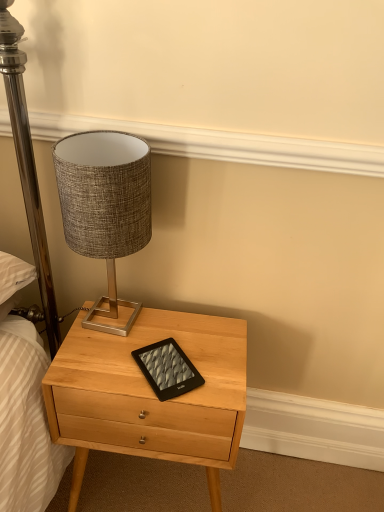
Question: Does light wood nightstand at center have a greater width compared to black matte tablet at center?

Choices:
 (A) no
 (B) yes

Answer: (B)

Question: Can you confirm if light wood nightstand at center is smaller than black matte tablet at center?

Choices:
 (A) yes
 (B) no

Answer: (B)

Question: From the image's perspective, is light wood nightstand at center under black matte tablet at center?

Choices:
 (A) yes
 (B) no

Answer: (A)

Question: Would you say light wood nightstand at center contains black matte tablet at center?

Choices:
 (A) no
 (B) yes

Answer: (B)

Question: Does light wood nightstand at center have a larger size compared to black matte tablet at center?

Choices:
 (A) yes
 (B) no

Answer: (A)

Question: In the image, is textured fabric lampshade at upper left on the left side or the right side of black matte tablet at center?

Choices:
 (A) left
 (B) right

Answer: (A)

Question: Which is correct: textured fabric lampshade at upper left is inside black matte tablet at center, or outside of it?

Choices:
 (A) inside
 (B) outside

Answer: (B)

Question: In terms of width, does textured fabric lampshade at upper left look wider or thinner when compared to black matte tablet at center?

Choices:
 (A) wide
 (B) thin

Answer: (A)

Question: Looking at the image, does textured fabric lampshade at upper left seem bigger or smaller compared to black matte tablet at center?

Choices:
 (A) big
 (B) small

Answer: (A)

Question: Is light wood nightstand at center in front of or behind black matte tablet at center in the image?

Choices:
 (A) behind
 (B) front

Answer: (B)

Question: Is light wood nightstand at center taller or shorter than black matte tablet at center?

Choices:
 (A) short
 (B) tall

Answer: (B)

Question: From a real-world perspective, is light wood nightstand at center positioned above or below black matte tablet at center?

Choices:
 (A) above
 (B) below

Answer: (B)

Question: Does point (87, 364) appear closer or farther from the camera than point (160, 391)?

Choices:
 (A) farther
 (B) closer

Answer: (A)

Question: Does point (84, 418) appear closer or farther from the camera than point (127, 201)?

Choices:
 (A) farther
 (B) closer

Answer: (A)

Question: Considering the positions of light wood nightstand at center and textured fabric lampshade at upper left in the image, is light wood nightstand at center bigger or smaller than textured fabric lampshade at upper left?

Choices:
 (A) small
 (B) big

Answer: (B)